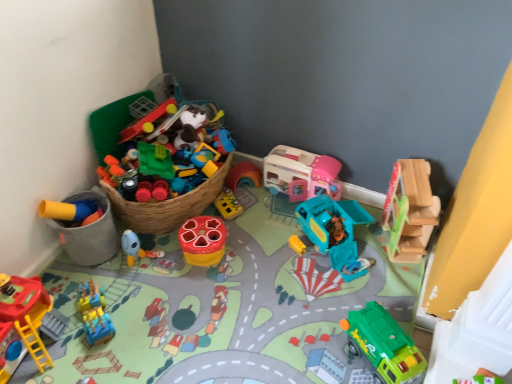
Where is `vacant space in front of pink plastic playhouse at upper right, marked as the fifth toy in a left-to-right arrangement`? vacant space in front of pink plastic playhouse at upper right, marked as the fifth toy in a left-to-right arrangement is located at coordinates (276, 225).